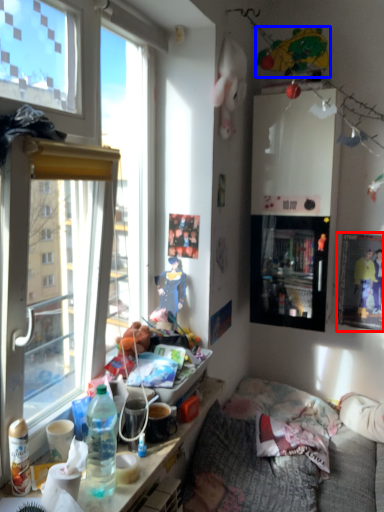
Question: Which point is closer to the camera, picture frame (highlighted by a red box) or toy (highlighted by a blue box)?

Choices:
 (A) picture frame
 (B) toy

Answer: (B)